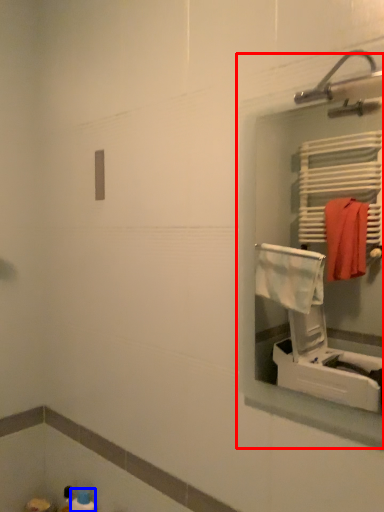
Question: Among these objects, which one is nearest to the camera, medicine cabinet (highlighted by a red box) or toiletry (highlighted by a blue box)?

Choices:
 (A) medicine cabinet
 (B) toiletry

Answer: (A)